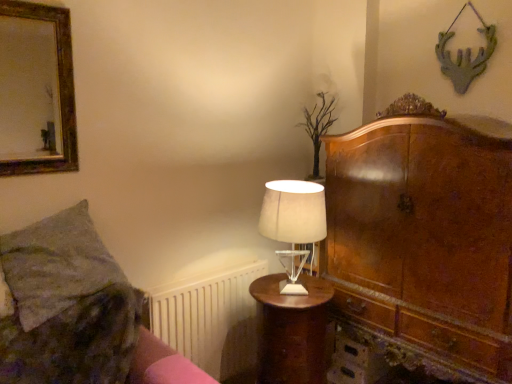
Question: Can you confirm if white plastic radiator at lower left is wider than translucent glass table lamp at center?

Choices:
 (A) yes
 (B) no

Answer: (B)

Question: Does white plastic radiator at lower left have a smaller size compared to translucent glass table lamp at center?

Choices:
 (A) no
 (B) yes

Answer: (A)

Question: Does white plastic radiator at lower left have a lesser height compared to translucent glass table lamp at center?

Choices:
 (A) no
 (B) yes

Answer: (A)

Question: From the image's perspective, is white plastic radiator at lower left under translucent glass table lamp at center?

Choices:
 (A) yes
 (B) no

Answer: (A)

Question: Is white plastic radiator at lower left surrounding translucent glass table lamp at center?

Choices:
 (A) yes
 (B) no

Answer: (B)

Question: Can you confirm if white plastic radiator at lower left is thinner than translucent glass table lamp at center?

Choices:
 (A) yes
 (B) no

Answer: (A)

Question: Are translucent glass table lamp at center and mahogany wood nightstand at center beside each other?

Choices:
 (A) no
 (B) yes

Answer: (A)

Question: From the image's perspective, is translucent glass table lamp at center on mahogany wood nightstand at center?

Choices:
 (A) no
 (B) yes

Answer: (B)

Question: Is translucent glass table lamp at center positioned before mahogany wood nightstand at center?

Choices:
 (A) yes
 (B) no

Answer: (A)

Question: Can you confirm if translucent glass table lamp at center is smaller than mahogany wood nightstand at center?

Choices:
 (A) yes
 (B) no

Answer: (A)

Question: From the image's perspective, does translucent glass table lamp at center appear lower than mahogany wood nightstand at center?

Choices:
 (A) no
 (B) yes

Answer: (A)

Question: Can you confirm if translucent glass table lamp at center is shorter than mahogany wood nightstand at center?

Choices:
 (A) yes
 (B) no

Answer: (A)

Question: Is green textured pillow at left behind pink fabric bed frame at lower left?

Choices:
 (A) yes
 (B) no

Answer: (A)